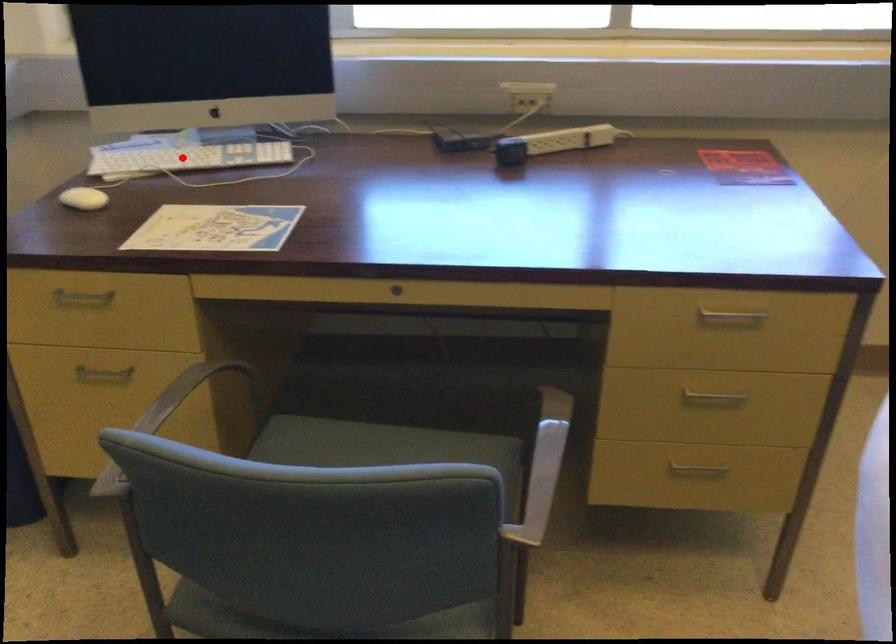
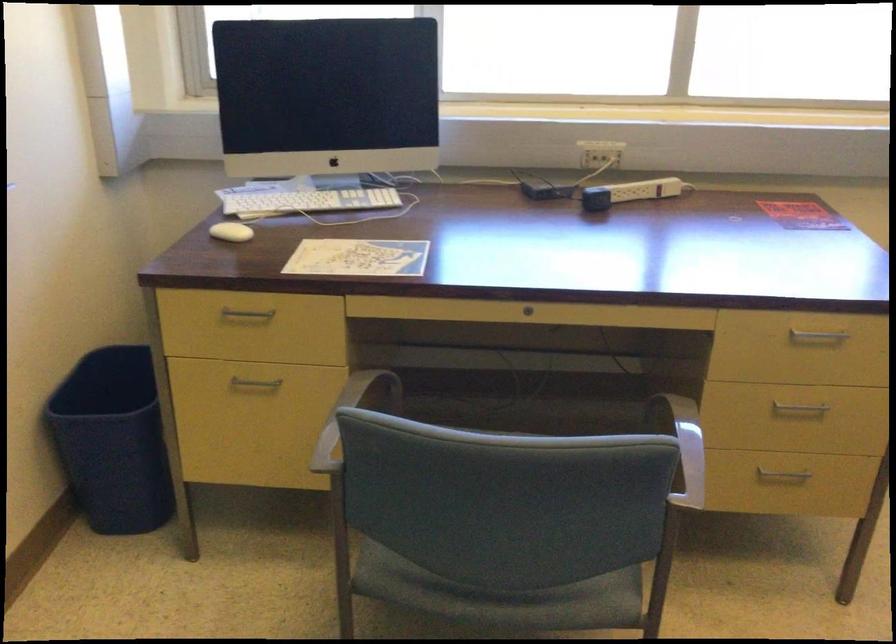
The point at the highlighted location is marked in the first image. Where is the corresponding point in the second image?

(304, 200)